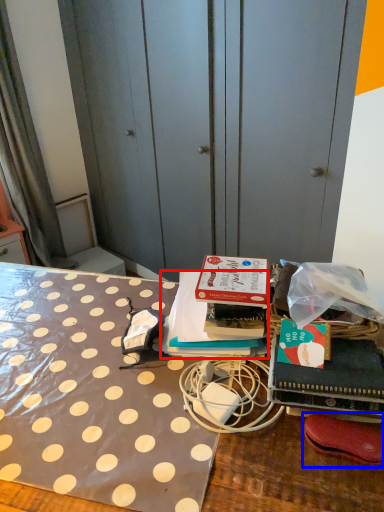
Question: Among these objects, which one is nearest to the camera, book (highlighted by a red box) or footwear (highlighted by a blue box)?

Choices:
 (A) book
 (B) footwear

Answer: (B)